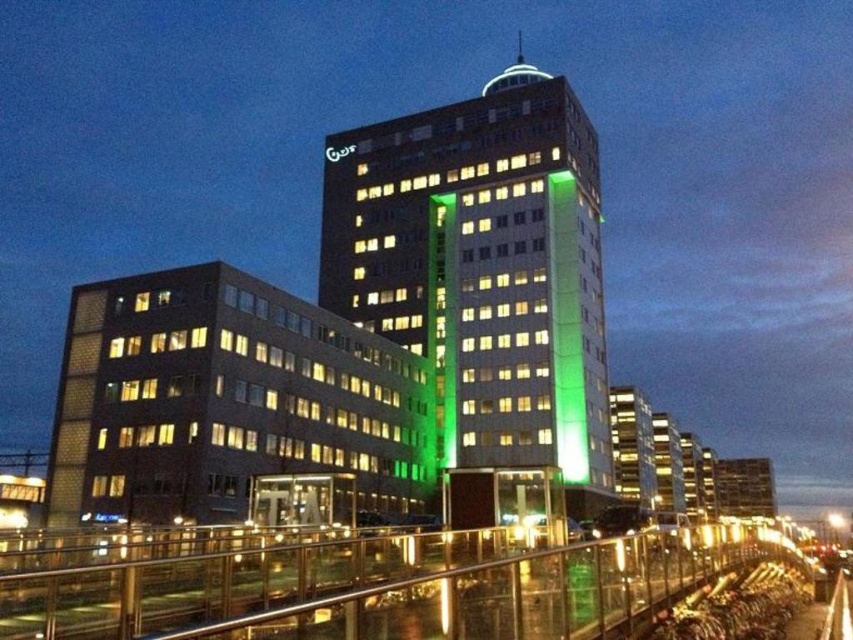
You are standing at the edge of the city park and see the brown brick building at lower left and the clear glass railing at lower center. Which object is closer to you?

The brown brick building at lower left is smaller than clear glass railing at lower center, so the clear glass railing at lower center is closer to you.

You are standing at the edge of the city park and see the green glass building at center and the clear glass railing at lower center. Which object is closer to you?

The clear glass railing at lower center is behind the green glass building at center, so the green glass building at center is closer to you.